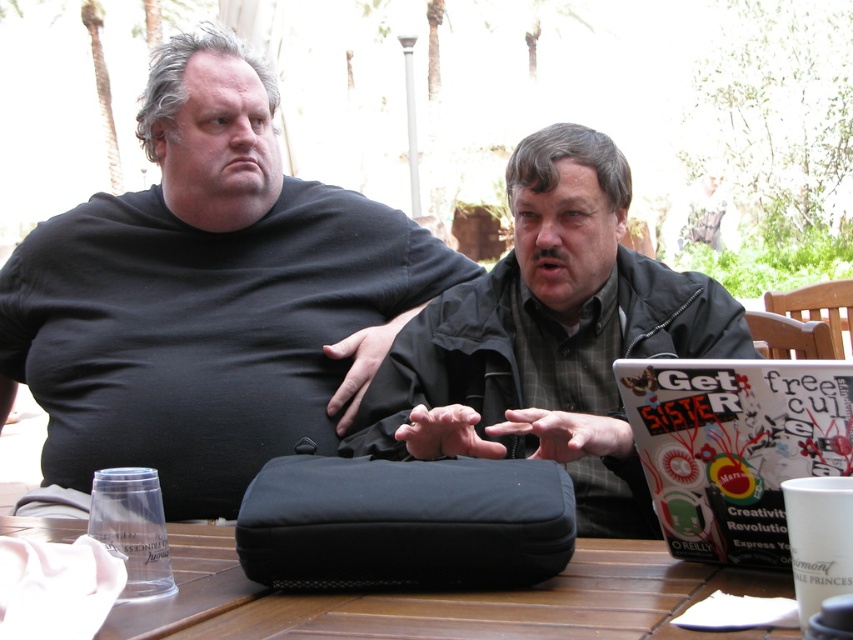
Question: Considering the real-world distances, which object is closest to the green plaid shirt at center?

Choices:
 (A) black fabric bag at center
 (B) black matte bag at center
 (C) wooden table at center

Answer: (A)

Question: Is the position of black matte bag at center less distant than that of black fabric bag at center?

Choices:
 (A) yes
 (B) no

Answer: (B)

Question: Can you confirm if green plaid shirt at center is wider than wooden table at center?

Choices:
 (A) no
 (B) yes

Answer: (A)

Question: Is green plaid shirt at center bigger than wooden table at center?

Choices:
 (A) no
 (B) yes

Answer: (B)

Question: Which point is closer to the camera taking this photo?

Choices:
 (A) (238, 451)
 (B) (610, 627)
 (C) (376, 401)
 (D) (527, 512)

Answer: (B)

Question: Estimate the real-world distances between objects in this image. Which object is farther from the green plaid shirt at center?

Choices:
 (A) wooden table at center
 (B) black matte bag at center
 (C) black fabric bag at center

Answer: (A)